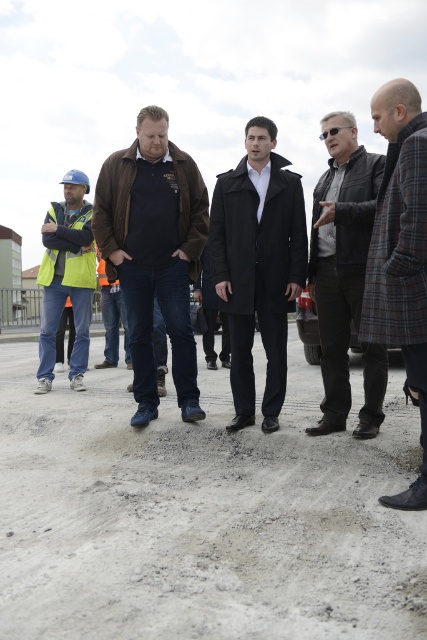
You are a photographer positioned at the back of the group. You want to take a photo of both the black wool coat at center and the leather jacket at center. Which one will appear closer to the camera in the photo?

The black wool coat at center will appear closer to the camera in the photo because it is positioned further to the viewer than the leather jacket at center.

You are a construction worker standing at point (x=377, y=228). You need to deliver a tool to a colleague who is 10.56 feet away. Is this distance within the safe range for tossing the tool? Please explain.

The distance between you and your colleague is 10.56 feet. Tossing tools over such a distance can pose safety risks due to potential loss of control or accidental injury. It is recommended to hand the tool directly or use a safer method of transfer.

You are a construction worker carrying a 3.5 feet long tool. You need to move from the gray gravel at center to the black wool coat at center. Can you move the tool horizontally between them without lifting it?

The distance between the gray gravel at center and black wool coat at center is 3.79 feet, which is greater than the tool length of 3.5 feet. Therefore, you can move the tool horizontally between them without lifting it.